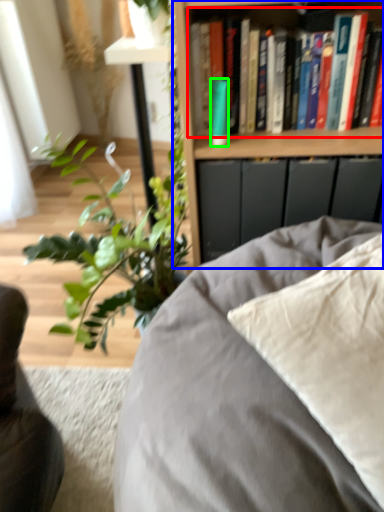
Question: Which object is positioned closest to book (highlighted by a red box)? Select from bookcase (highlighted by a blue box) and paperback book (highlighted by a green box).

Choices:
 (A) bookcase
 (B) paperback book

Answer: (A)